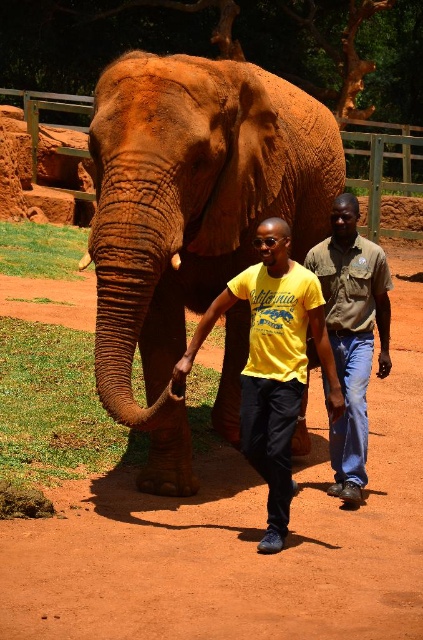
Can you confirm if brown dirt field at center is positioned to the left of brown textured elephant at center?

Correct, you'll find brown dirt field at center to the left of brown textured elephant at center.

Is brown dirt field at center to the right of brown textured elephant at center from the viewer's perspective?

Incorrect, brown dirt field at center is not on the right side of brown textured elephant at center.

At what (x,y) coordinates should I click in order to perform the action: click on brown dirt field at center. Please return your answer as a coordinate pair (x, y). This screenshot has width=423, height=640. Looking at the image, I should click on (239, 536).

Does yellow t-shirt at center have a greater height compared to khaki cotton shirt at center?

Incorrect, yellow t-shirt at center's height is not larger of khaki cotton shirt at center's.

Based on the photo, how far apart are yellow t-shirt at center and khaki cotton shirt at center?

yellow t-shirt at center and khaki cotton shirt at center are 23.93 inches apart.

The height and width of the screenshot is (640, 423). What do you see at coordinates (271, 364) in the screenshot?
I see `yellow t-shirt at center` at bounding box center [271, 364].

This screenshot has height=640, width=423. I want to click on yellow t-shirt at center, so click(x=271, y=364).

Between brown dirt field at center and khaki cotton shirt at center, which one appears on the right side from the viewer's perspective?

khaki cotton shirt at center

Does point (200, 544) come closer to viewer compared to point (362, 257)?

That is True.

Identify the location of brown dirt field at center. (239, 536).